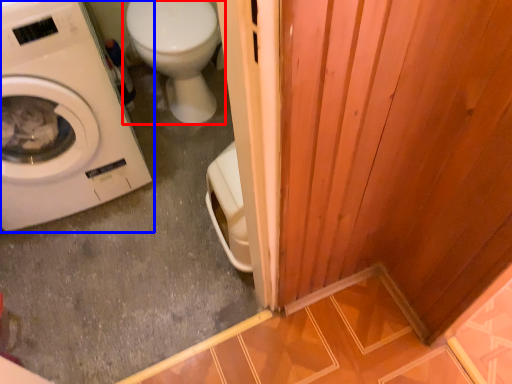
Question: Which point is closer to the camera, toilet (highlighted by a red box) or washing machine (highlighted by a blue box)?

Choices:
 (A) toilet
 (B) washing machine

Answer: (B)